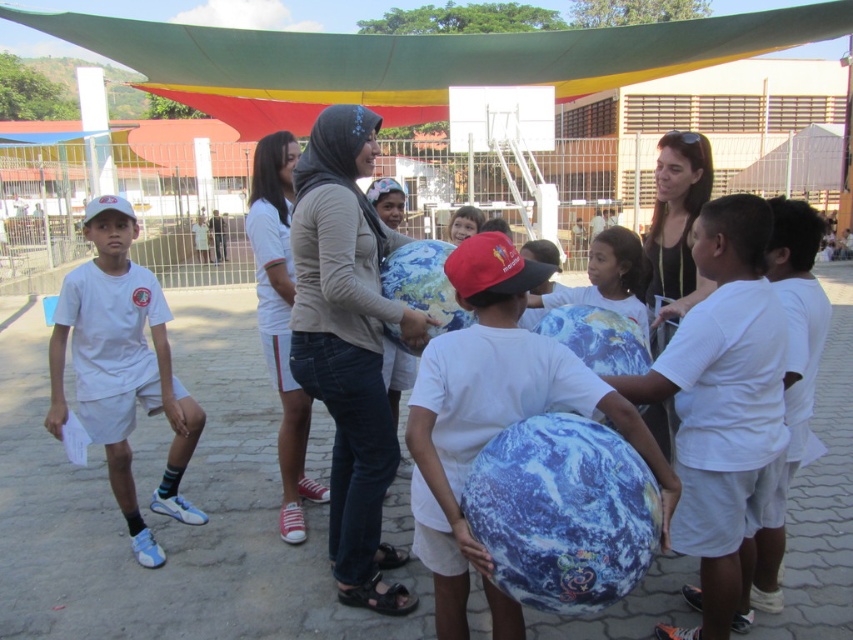
Can you confirm if blue fabric beach ball at center is taller than earth-patterned fabric globe at center?

No.

Between blue fabric beach ball at center and earth-patterned fabric globe at center, which one is positioned higher?

earth-patterned fabric globe at center is above.

Image resolution: width=853 pixels, height=640 pixels. What do you see at coordinates (563, 513) in the screenshot?
I see `blue fabric beach ball at center` at bounding box center [563, 513].

This screenshot has width=853, height=640. In order to click on blue fabric beach ball at center in this screenshot , I will do `click(563, 513)`.

Consider the image. Which is more to the right, matte gray hoodie at center or earth-patterned fabric globe at center?

From the viewer's perspective, earth-patterned fabric globe at center appears more on the right side.

Measure the distance between matte gray hoodie at center and earth-patterned fabric globe at center.

matte gray hoodie at center and earth-patterned fabric globe at center are 14.30 inches apart from each other.

Image resolution: width=853 pixels, height=640 pixels. What do you see at coordinates (349, 346) in the screenshot?
I see `matte gray hoodie at center` at bounding box center [349, 346].

Where is `matte gray hoodie at center`? The height and width of the screenshot is (640, 853). matte gray hoodie at center is located at coordinates (349, 346).

This screenshot has width=853, height=640. Describe the element at coordinates (280, 317) in the screenshot. I see `denim jeans at center` at that location.

Is denim jeans at center wider than earth-patterned fabric globe at center?

Correct, the width of denim jeans at center exceeds that of earth-patterned fabric globe at center.

Is point (286, 349) closer to viewer compared to point (428, 333)?

No, (286, 349) is further to viewer.

I want to click on denim jeans at center, so click(280, 317).